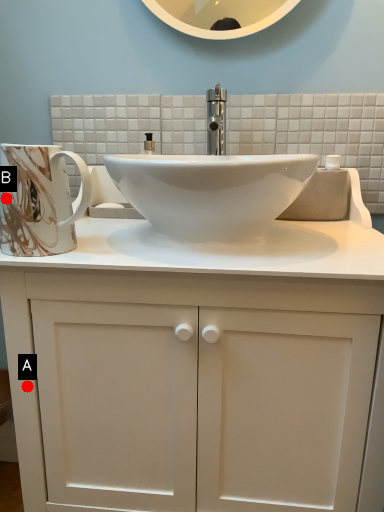
Question: Two points are circled on the image, labeled by A and B beside each circle. Which point is farther from the camera taking this photo?

Choices:
 (A) A is further
 (B) B is further

Answer: (A)